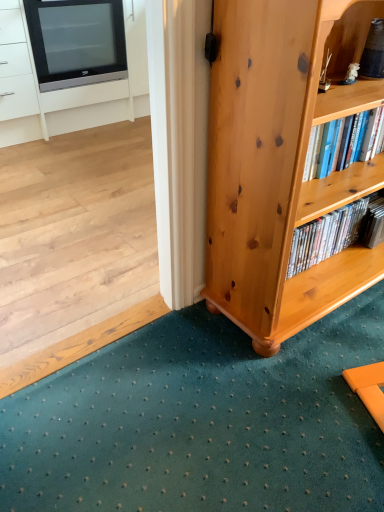
Where is `free space in front of light brown wood bookcase at lower right`? free space in front of light brown wood bookcase at lower right is located at coordinates (295, 395).